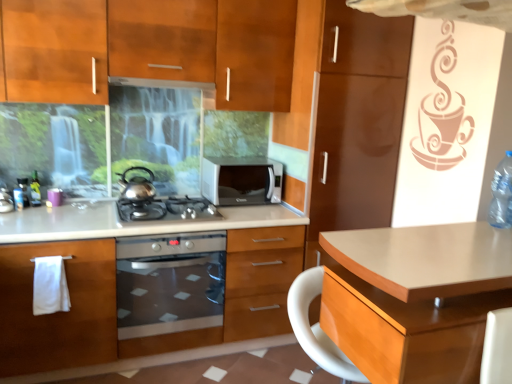
You are a GUI agent. You are given a task and a screenshot of the screen. Output one action in this format:
    pyautogui.click(x=<x>, y=<y>)
    Task: Click on the vacant area that lies to the right of metallic silver bottle at left, which is the second bottle in front-to-back order
    The image size is (512, 384).
    Given the screenshot: What is the action you would take?
    pyautogui.click(x=64, y=210)